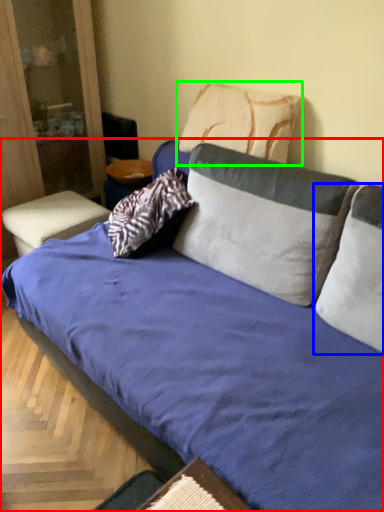
Question: Estimate the real-world distances between objects in this image. Which object is closer to studio couch (highlighted by a red box), pillow (highlighted by a blue box) or pillow (highlighted by a green box)?

Choices:
 (A) pillow
 (B) pillow

Answer: (A)